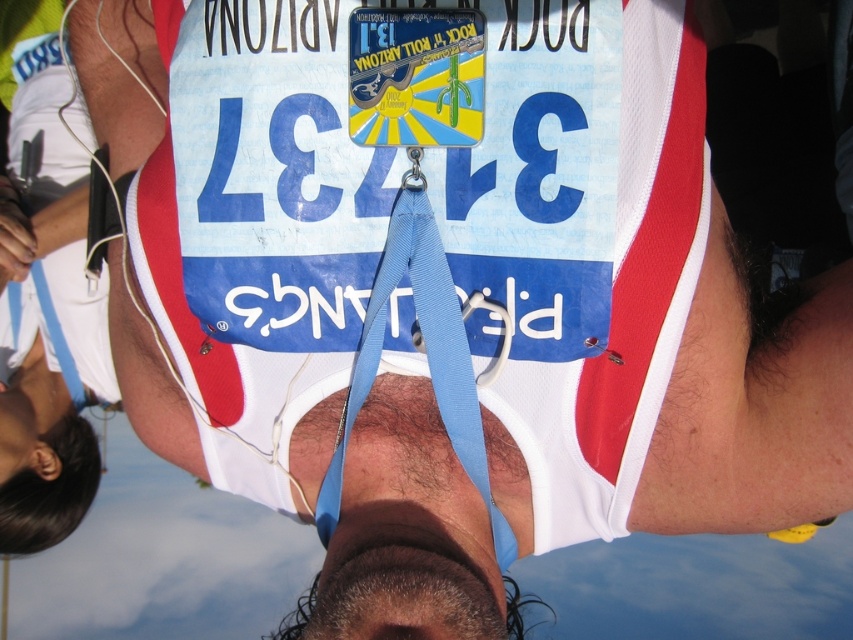
Question: Is blue fabric strap at center bigger than black hair at lower left?

Choices:
 (A) yes
 (B) no

Answer: (A)

Question: Does blue fabric strap at center have a smaller size compared to black hair at lower left?

Choices:
 (A) no
 (B) yes

Answer: (A)

Question: Which object appears farthest from the camera in this image?

Choices:
 (A) black hair at lower left
 (B) blue fabric strap at center

Answer: (A)

Question: Which point is farther to the camera?

Choices:
 (A) black hair at lower left
 (B) blue fabric strap at center

Answer: (A)

Question: Is blue fabric strap at center closer to camera compared to black hair at lower left?

Choices:
 (A) no
 (B) yes

Answer: (B)